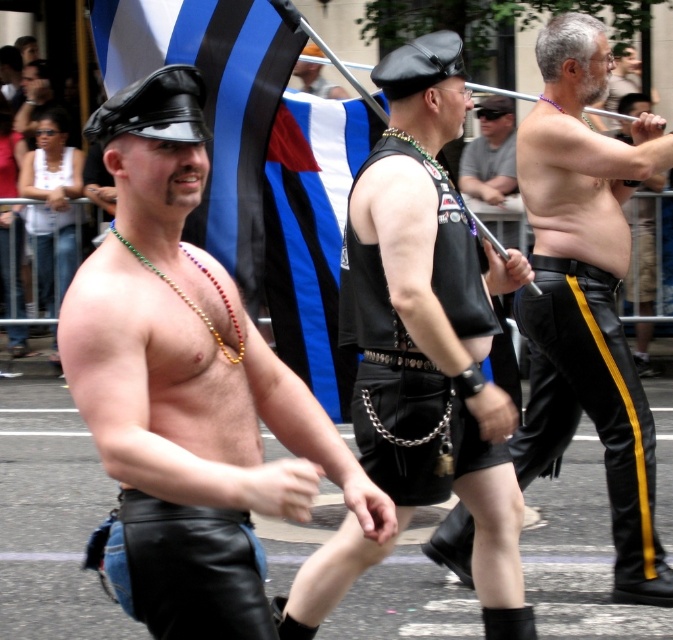
You are a photographer trying to capture both the black leather hat at upper left and the leather cap at center in a single frame. Given their widths, which object should you zoom in on to ensure both fit in the photo?

Since the black leather hat at upper left is wider than the leather cap at center, you should zoom out slightly to ensure both fit in the frame. However, if you must zoom in, prioritize the narrower object, which is the leather cap at center, to include both without cropping.

You are a photographer at the parade and want to capture both the black leather hat at upper left and the leather cap at center in a single shot. Which object should you position closer to the left side of your camera frame to ensure both are included?

To include both the black leather hat at upper left and the leather cap at center in your shot, position the black leather hat at upper left closer to the left side of the frame since it is already to the left of the leather cap at center.

You are a photographer trying to capture a closeup shot of the black leather vest at center and the black leather pants at center. Based on their widths, which one should you zoom in on first to ensure they both fit in the frame?

The black leather vest at center is wider than the black leather pants at center, so you should zoom out slightly to ensure the vest fits first, then adjust to include the pants.